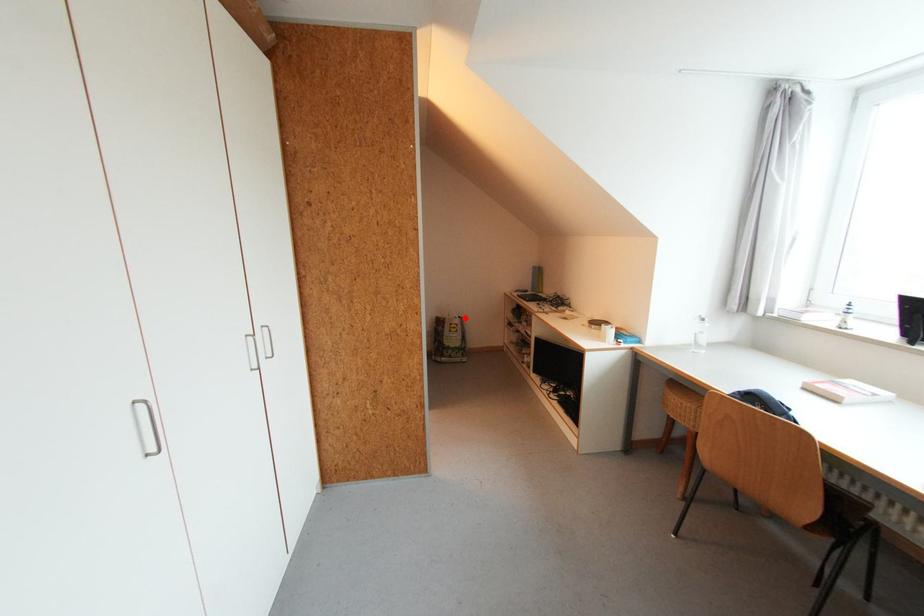
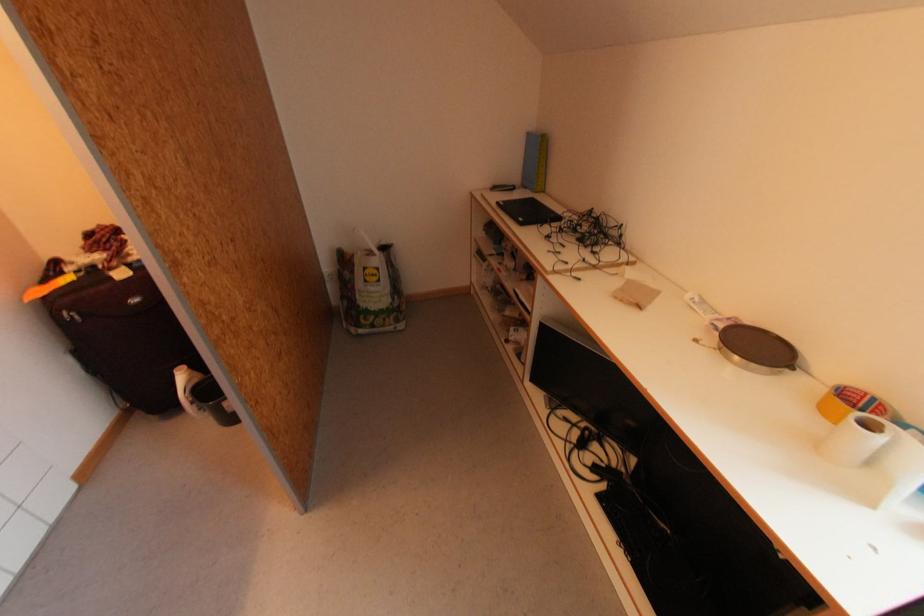
Find the pixel in the second image that matches the highlighted location in the first image.

(390, 249)